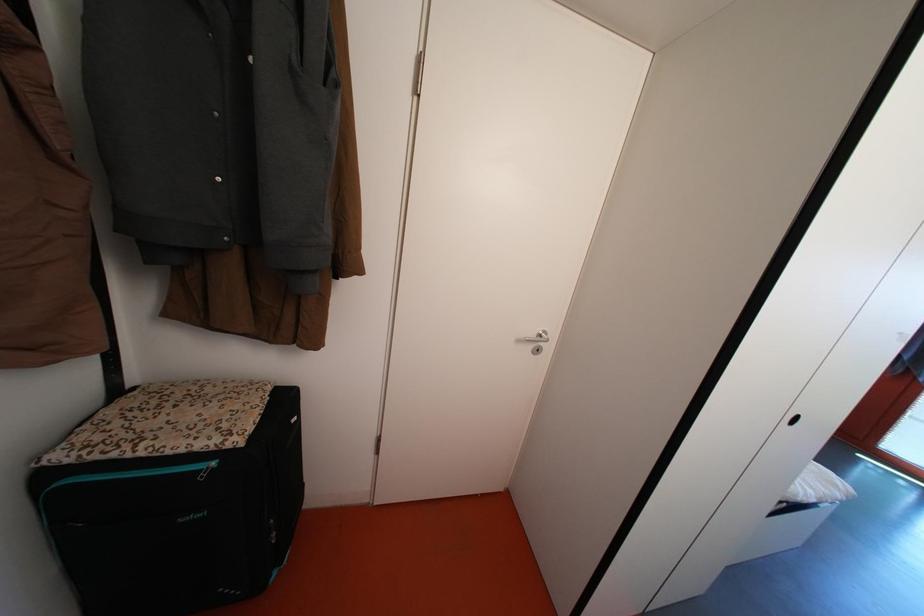
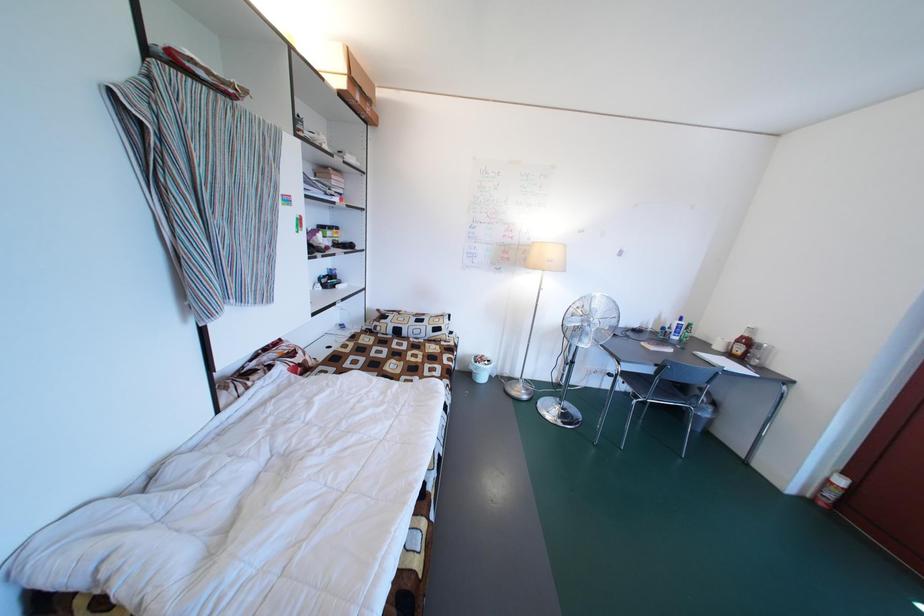
Question: Which direction would the cameraman need to move to produce the second image? Reply with the corresponding letter.

Choices:
 (A) Left
 (B) Right
 (C) Forward
 (D) Backward

Answer: (B)